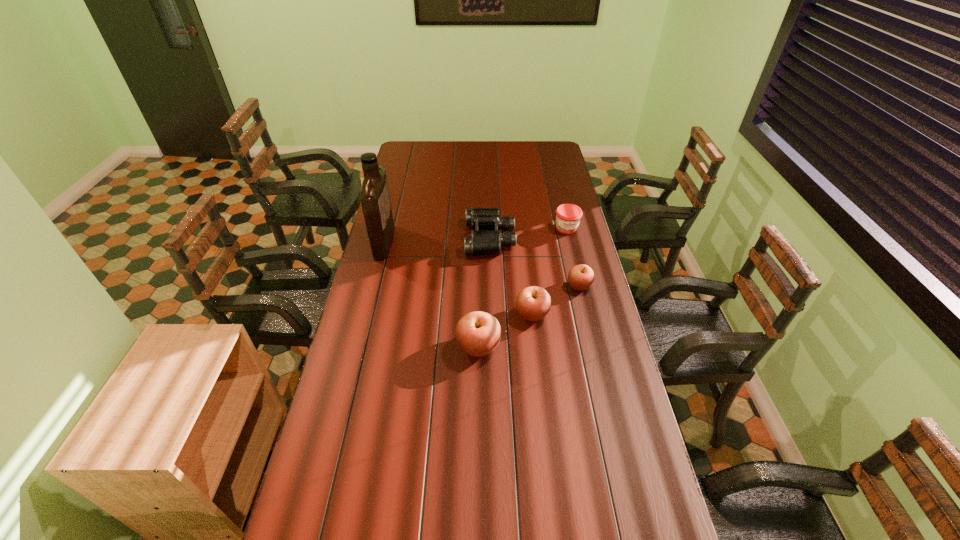
At what (x,y) coordinates should I click in order to perform the action: click on blank space that satisfies the following two spatial constraints: 1. on the label side of the leftmost object; 2. on the left side of the second apple from left to right. Please return your answer as a coordinate pair (x, y). Looking at the image, I should click on (366, 314).

Image resolution: width=960 pixels, height=540 pixels. In order to click on vacant space that satisfies the following two spatial constraints: 1. on the label side of the leftmost object; 2. on the right side of the tallest apple in this screenshot , I will do `click(357, 347)`.

This screenshot has width=960, height=540. Find the location of `vacant position in the image that satisfies the following two spatial constraints: 1. on the label side of the leftmost object; 2. on the right side of the second apple from right to left`. vacant position in the image that satisfies the following two spatial constraints: 1. on the label side of the leftmost object; 2. on the right side of the second apple from right to left is located at coordinates (366, 314).

Locate an element on the screen. free spot that satisfies the following two spatial constraints: 1. on the label side of the shortest apple; 2. on the right side of the leftmost object is located at coordinates (372, 286).

Find the location of a particular element. The width and height of the screenshot is (960, 540). blank area in the image that satisfies the following two spatial constraints: 1. on the label side of the jam; 2. on the label side of the leftmost object is located at coordinates pos(570,242).

Where is `vacant space that satisfies the following two spatial constraints: 1. on the label side of the leftmost object; 2. on the back side of the fifth shortest object`? Image resolution: width=960 pixels, height=540 pixels. vacant space that satisfies the following two spatial constraints: 1. on the label side of the leftmost object; 2. on the back side of the fifth shortest object is located at coordinates (357, 347).